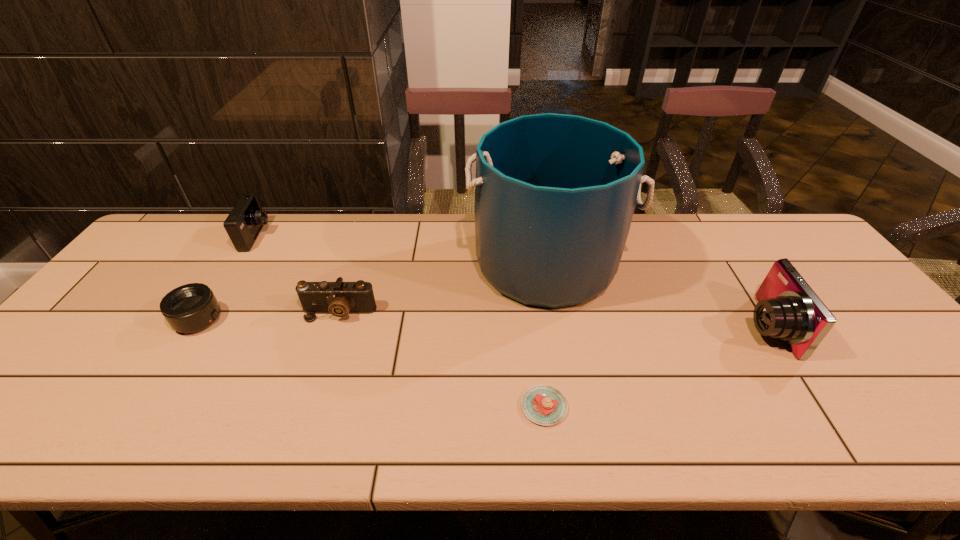
Identify the location of vacant space located on the front of the bucket. The image size is (960, 540). (559, 336).

This screenshot has height=540, width=960. What are the coordinates of `vacant point located 0.190m on the front-facing side of the rightmost camera` in the screenshot? It's located at (669, 326).

Locate an element on the screen. vacant space located on the front-facing side of the rightmost camera is located at coordinates (678, 326).

Image resolution: width=960 pixels, height=540 pixels. In order to click on free region located 0.250m on the front-facing side of the rightmost camera in this screenshot , I will do `click(646, 326)`.

Locate an element on the screen. The width and height of the screenshot is (960, 540). free space located 0.140m on the front-facing side of the fourth shortest object is located at coordinates (312, 237).

Locate an element on the screen. vacant region located 0.160m on the front-facing side of the shortest camera is located at coordinates (319, 375).

The image size is (960, 540). What are the coordinates of `vacant space located 0.320m on the side of the fifth tallest object with brand markings and control switches` in the screenshot? It's located at (345, 320).

Where is `free space located 0.320m on the left of the pastry`? This screenshot has height=540, width=960. free space located 0.320m on the left of the pastry is located at coordinates (374, 407).

Locate an element on the screen. bucket present at the far edge is located at coordinates (555, 194).

Where is `camera situated at the far edge`? This screenshot has width=960, height=540. camera situated at the far edge is located at coordinates (244, 223).